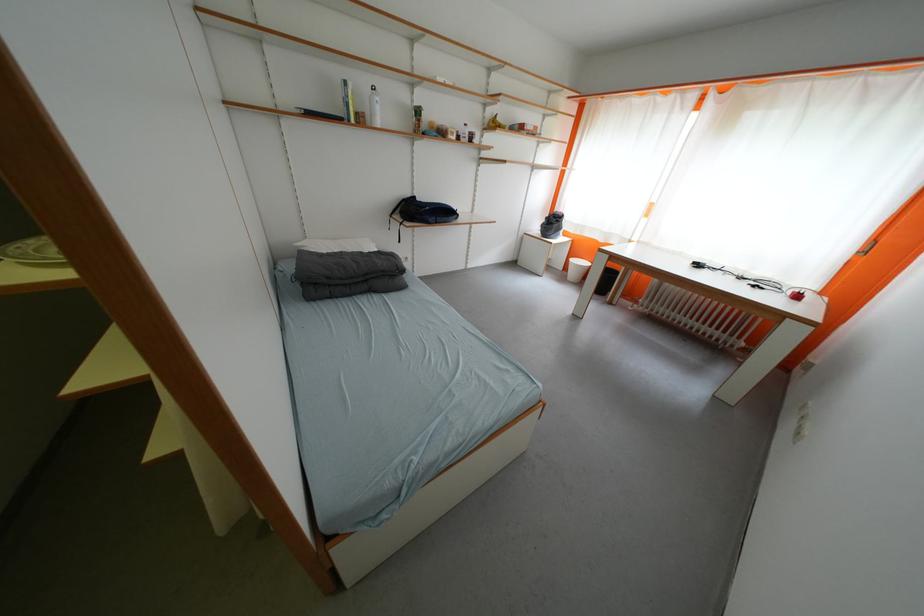
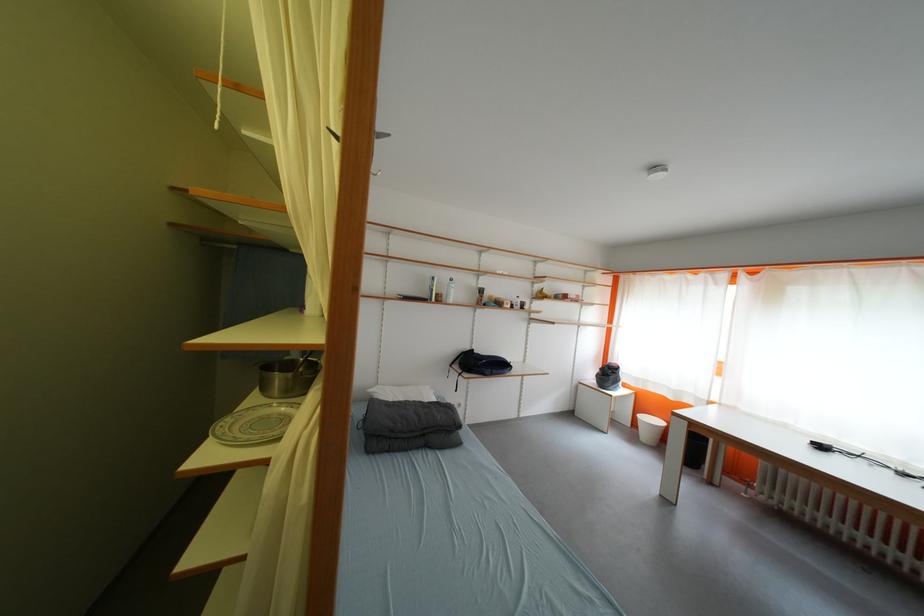
Locate, in the second image, the point that corresponds to [375,284] in the first image.

(432, 438)